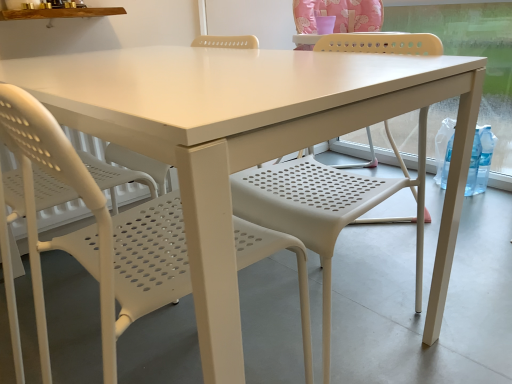
The height and width of the screenshot is (384, 512). Identify the location of white perforated plastic chair at left. (97, 231).

Describe the element at coordinates (97, 231) in the screenshot. The height and width of the screenshot is (384, 512). I see `white perforated plastic chair at left` at that location.

The image size is (512, 384). I want to click on white perforated plastic chair at left, so click(97, 231).